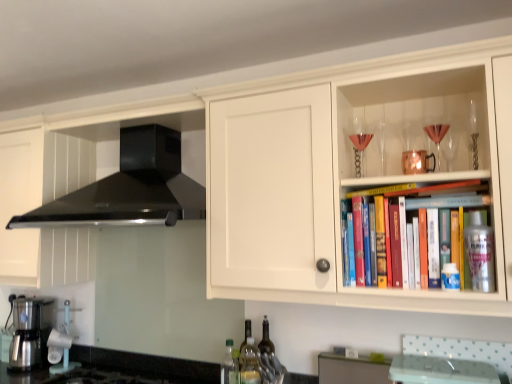
Locate an element on the screen. The width and height of the screenshot is (512, 384). black granite countertop at lower left is located at coordinates (162, 370).

The width and height of the screenshot is (512, 384). In order to click on metallic silver spray can at upper right, the first bottle positioned from the right in this screenshot , I will do `click(479, 252)`.

This screenshot has height=384, width=512. Find the location of `translucent plastic bottle at lower center, marked as the 2th bottle in a back-to-front arrangement`. translucent plastic bottle at lower center, marked as the 2th bottle in a back-to-front arrangement is located at coordinates (249, 363).

Where is `translucent glass wine glass at upper right, the 1th wine glass in the right-to-left sequence`? Image resolution: width=512 pixels, height=384 pixels. translucent glass wine glass at upper right, the 1th wine glass in the right-to-left sequence is located at coordinates (436, 137).

Describe the element at coordinates (267, 353) in the screenshot. I see `translucent glass bottle at lower center, acting as the 4th bottle starting from the front` at that location.

Where is `white wood cabinet at upper right, placed as the 1th cabinetry when sorted from front to back`? The width and height of the screenshot is (512, 384). white wood cabinet at upper right, placed as the 1th cabinetry when sorted from front to back is located at coordinates (332, 95).

Considering the positions of point (45, 340) and point (480, 221), is point (45, 340) closer or farther from the camera than point (480, 221)?

Point (45, 340) appears to be farther away from the viewer than point (480, 221).

From a real-world perspective, between metallic silver coffee maker at lower left and metallic silver spray can at upper right, which appears as the 4th bottle when viewed from the back, who is vertically lower?

From a 3D spatial view, metallic silver coffee maker at lower left is below.

Where is `kitchen appliance beneath the metallic silver spray can at upper right, which appears as the 4th bottle when viewed from the back (from a real-world perspective)`? This screenshot has width=512, height=384. kitchen appliance beneath the metallic silver spray can at upper right, which appears as the 4th bottle when viewed from the back (from a real-world perspective) is located at coordinates (27, 333).

Looking at their sizes, would you say metallic silver coffee maker at lower left is wider or thinner than metallic silver spray can at upper right, the first bottle positioned from the right?

In the image, metallic silver coffee maker at lower left appears to be wider than metallic silver spray can at upper right, the first bottle positioned from the right.

Relative to green plastic bottle at lower center, which ranks as the 3th bottle in back-to-front order, is translucent glass bottle at lower center, arranged as the 1th bottle when viewed from the back, in front or behind?

Visually, translucent glass bottle at lower center, arranged as the 1th bottle when viewed from the back, is located behind green plastic bottle at lower center, which ranks as the 3th bottle in back-to-front order.

From the picture: Who is taller, translucent glass bottle at lower center, acting as the 4th bottle starting from the front, or green plastic bottle at lower center, the fourth bottle when ordered from right to left?

Standing taller between the two is translucent glass bottle at lower center, acting as the 4th bottle starting from the front.

Based on the photo, how distant is translucent glass bottle at lower center, arranged as the 1th bottle when viewed from the back, from green plastic bottle at lower center, which ranks as the 3th bottle in back-to-front order?

20.70 centimeters.

Which bottle is the 2nd one when counting from the back of the green plastic bottle at lower center, the fourth bottle when ordered from right to left? Please provide its 2D coordinates.

[(267, 353)]

This screenshot has width=512, height=384. I want to click on bottle that is the 3rd one below the black matte range hood at upper left (from a real-world perspective), so click(249, 363).

From the picture: Does translucent plastic bottle at lower center, which appears as the second bottle when viewed from the left, have a smaller size compared to black matte range hood at upper left?

Correct, translucent plastic bottle at lower center, which appears as the second bottle when viewed from the left, occupies less space than black matte range hood at upper left.

Is translucent plastic bottle at lower center, which appears as the second bottle when viewed from the left, aimed at black matte range hood at upper left?

No.

Between white wood cabinet at upper right, marked as the 1th cabinetry in a top-to-bottom arrangement, and black matte range hood at upper left, which one has smaller size?

Smaller between the two is black matte range hood at upper left.

Which of these two, white wood cabinet at upper right, placed as the 1th cabinetry when sorted from front to back, or black matte range hood at upper left, stands shorter?

With less height is black matte range hood at upper left.

In terms of height, does green plastic bottle at lower center, the fourth bottle when ordered from right to left, look taller or shorter compared to metallic silver coffee maker at lower left?

In the image, green plastic bottle at lower center, the fourth bottle when ordered from right to left, appears to be shorter than metallic silver coffee maker at lower left.

Locate an element on the screen. kitchen appliance that is on the left side of green plastic bottle at lower center, acting as the first bottle starting from the left is located at coordinates (27, 333).

From the image's perspective, is green plastic bottle at lower center, the second bottle when ordered from front to back, under metallic silver coffee maker at lower left?

No.

Is green plastic bottle at lower center, acting as the first bottle starting from the left, at the left side of metallic silver coffee maker at lower left?

No.

Which is correct: black granite countertop at lower left is inside metallic silver coffee maker at lower left, or outside of it?

black granite countertop at lower left lies outside metallic silver coffee maker at lower left.

Is black granite countertop at lower left further to camera compared to metallic silver coffee maker at lower left?

No, it is in front of metallic silver coffee maker at lower left.

From a real-world perspective, does black granite countertop at lower left stand above metallic silver coffee maker at lower left?

Incorrect, from a real-world perspective, black granite countertop at lower left is lower than metallic silver coffee maker at lower left.

Can we say matte gray cabinet at lower center, the first cabinetry in the back-to-front sequence, lies outside translucent glass wine glass at upper right, the 1th wine glass in the right-to-left sequence?

Yes, matte gray cabinet at lower center, the first cabinetry in the back-to-front sequence, is located beyond the bounds of translucent glass wine glass at upper right, the 1th wine glass in the right-to-left sequence.

Can you confirm if matte gray cabinet at lower center, the first cabinetry in the back-to-front sequence, is positioned to the left of translucent glass wine glass at upper right, the 1th wine glass in the right-to-left sequence?

Correct, you'll find matte gray cabinet at lower center, the first cabinetry in the back-to-front sequence, to the left of translucent glass wine glass at upper right, the 1th wine glass in the right-to-left sequence.

From the image's perspective, does matte gray cabinet at lower center, which ranks as the 2th cabinetry in top-to-bottom order, appear higher than translucent glass wine glass at upper right, the 1th wine glass in the right-to-left sequence?

Incorrect, from the image's perspective, matte gray cabinet at lower center, which ranks as the 2th cabinetry in top-to-bottom order, is lower than translucent glass wine glass at upper right, the 1th wine glass in the right-to-left sequence.

Which of these two, matte gray cabinet at lower center, the first cabinetry in the right-to-left sequence, or translucent glass wine glass at upper right, arranged as the 2th wine glass when viewed from the left, is bigger?

With larger size is matte gray cabinet at lower center, the first cabinetry in the right-to-left sequence.

The image size is (512, 384). I want to click on bottle that is the 4th one when counting upward from the metallic silver coffee maker at lower left (from the image's perspective), so click(479, 252).

Find the location of a particular element. This screenshot has height=384, width=512. the 2nd bottle behind the green plastic bottle at lower center, which ranks as the 3th bottle in back-to-front order is located at coordinates (267, 353).

Based on their spatial positions, is black matte range hood at upper left or clear glass wine glass at upper right, positioned as the 2th wine glass in front-to-back order, closer to translucent plastic bottle at lower center, arranged as the third bottle when viewed from the right?

clear glass wine glass at upper right, positioned as the 2th wine glass in front-to-back order, is closer to translucent plastic bottle at lower center, arranged as the third bottle when viewed from the right.

When comparing their distances from black matte range hood at upper left, does white wood cabinet at upper right, which is counted as the 2th cabinetry, starting from the right, or matte gray cabinet at lower center, acting as the 2th cabinetry starting from the front, seem closer?

white wood cabinet at upper right, which is counted as the 2th cabinetry, starting from the right.

Based on their spatial positions, is translucent glass bottle at lower center, arranged as the 1th bottle when viewed from the back, or metallic silver coffee maker at lower left closer to translucent glass wine glass at upper right, arranged as the 1th wine glass when viewed from the front?

translucent glass bottle at lower center, arranged as the 1th bottle when viewed from the back.

Which object lies nearer to the anchor point metallic silver spray can at upper right, the first bottle positioned from the right, white wood cabinet at upper right, marked as the first cabinetry in a left-to-right arrangement, or translucent glass bottle at lower center, arranged as the 1th bottle when viewed from the back?

white wood cabinet at upper right, marked as the first cabinetry in a left-to-right arrangement, lies closer to metallic silver spray can at upper right, the first bottle positioned from the right, than the other object.

Looking at the image, which one is located closer to black granite countertop at lower left, translucent glass bottle at lower center, arranged as the 1th bottle when viewed from the back, or translucent plastic bottle at lower center, which appears as the second bottle when viewed from the left?

translucent plastic bottle at lower center, which appears as the second bottle when viewed from the left, is closer to black granite countertop at lower left.

Which object lies nearer to the anchor point clear glass wine glass at upper right, the first wine glass positioned from the left, translucent glass wine glass at upper right, arranged as the 2th wine glass when viewed from the left, or metallic silver spray can at upper right, the 4th bottle positioned from the left?

translucent glass wine glass at upper right, arranged as the 2th wine glass when viewed from the left, lies closer to clear glass wine glass at upper right, the first wine glass positioned from the left, than the other object.

Looking at this image, considering their positions, is translucent glass bottle at lower center, marked as the second bottle in a right-to-left arrangement, positioned further to translucent plastic bottle at lower center, marked as the 2th bottle in a back-to-front arrangement, than metallic silver coffee maker at lower left?

Based on the image, metallic silver coffee maker at lower left appears to be further to translucent plastic bottle at lower center, marked as the 2th bottle in a back-to-front arrangement.

Estimate the real-world distances between objects in this image. Which object is further from green plastic bottle at lower center, acting as the first bottle starting from the left, translucent plastic bottle at lower center, marked as the 2th bottle in a back-to-front arrangement, or white wood cabinet at upper right, marked as the 1th cabinetry in a top-to-bottom arrangement?

Among the two, white wood cabinet at upper right, marked as the 1th cabinetry in a top-to-bottom arrangement, is located further to green plastic bottle at lower center, acting as the first bottle starting from the left.

This screenshot has height=384, width=512. What are the coordinates of `home appliance between metallic silver coffee maker at lower left and matte gray cabinet at lower center, the first cabinetry in the back-to-front sequence, in the horizontal direction` in the screenshot? It's located at coord(130,188).

Identify the location of wine glass between metallic silver coffee maker at lower left and translucent glass wine glass at upper right, arranged as the 1th wine glass when viewed from the front, from left to right. The height and width of the screenshot is (384, 512). (360, 143).

Where is `wine glass between translucent glass wine glass at upper right, arranged as the 1th wine glass when viewed from the front, and matte gray cabinet at lower center, the 2th cabinetry in the left-to-right sequence, vertically`? The height and width of the screenshot is (384, 512). wine glass between translucent glass wine glass at upper right, arranged as the 1th wine glass when viewed from the front, and matte gray cabinet at lower center, the 2th cabinetry in the left-to-right sequence, vertically is located at coordinates (360, 143).

This screenshot has width=512, height=384. Find the location of `home appliance between metallic silver coffee maker at lower left and translucent glass wine glass at upper right, arranged as the 1th wine glass when viewed from the front, in the horizontal direction`. home appliance between metallic silver coffee maker at lower left and translucent glass wine glass at upper right, arranged as the 1th wine glass when viewed from the front, in the horizontal direction is located at coordinates (130, 188).